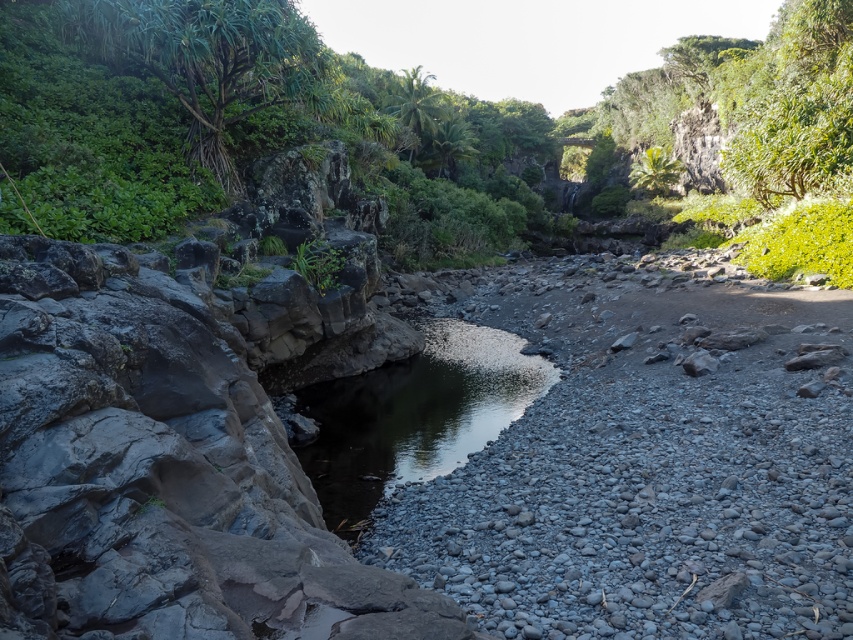
Question: Is green leafy shrubs at center below clear water at center?

Choices:
 (A) no
 (B) yes

Answer: (A)

Question: Is green leafy shrubs at center to the right of clear water at center from the viewer's perspective?

Choices:
 (A) no
 (B) yes

Answer: (B)

Question: Is green leafy shrubs at center to the left of clear water at center from the viewer's perspective?

Choices:
 (A) yes
 (B) no

Answer: (B)

Question: Which object is farther from the camera taking this photo?

Choices:
 (A) green leafy shrubs at center
 (B) clear water at center

Answer: (A)

Question: Which of the following is the farthest from the observer?

Choices:
 (A) green leafy shrubs at center
 (B) clear water at center

Answer: (A)